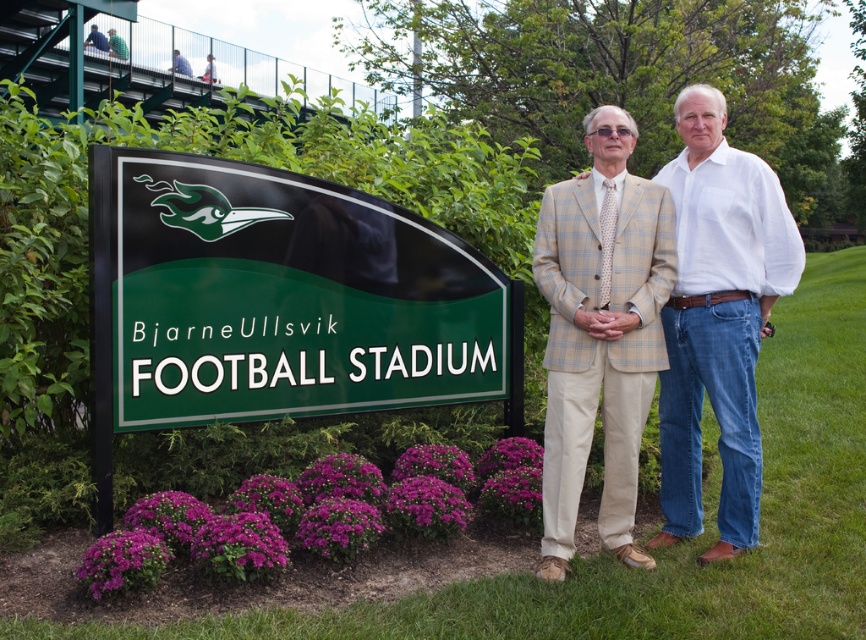
You are a photographer setting up for a group photo at the Bjarne Ullsvik Football Stadium. You need to ensure that the green glossy sign at lower left and the blue shirt at upper left are both visible in the frame. Based on their heights, which object should you prioritize keeping in the center to avoid cropping?

The green glossy sign at lower left is taller than the blue shirt at upper left, so you should prioritize keeping the green glossy sign at lower left in the center to avoid cropping since it is taller and requires more space vertically.

You are taking a photo of the Bjarne Ullsvik Football Stadium sign. You want to focus on the point at the bottom right corner of the sign. Which of the two points, point 1 at coordinates point (695,349) or point 2 at coordinates point (184,67), is closer to the camera and should be your focus point?

Point 1 at coordinates point (695,349) is closer to the camera than point 2 at coordinates point (184,67), so you should focus on point 1 at coordinates point (695,349).

From the picture: You are a photographer taking a picture of the blue shirt at upper left and the green glossy sign at lower left. Which object is positioned to the right of the other?

The green glossy sign at lower left is to the right of the blue shirt at upper left.